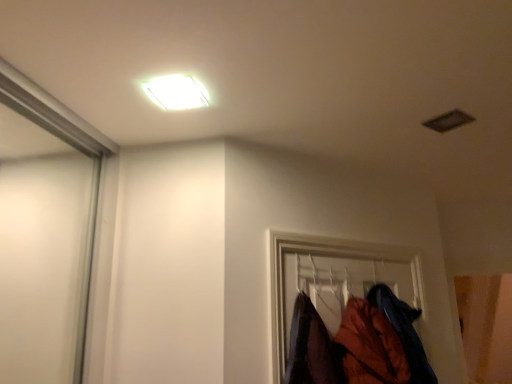
Question: Does velvet-like orange coat at lower right, which is the second clothing in right-to-left order, come behind white glossy light fixture at upper center?

Choices:
 (A) no
 (B) yes

Answer: (B)

Question: Is velvet-like orange coat at lower right, which is the first clothing from left to right, oriented towards white glossy light fixture at upper center?

Choices:
 (A) yes
 (B) no

Answer: (B)

Question: From a real-world perspective, is velvet-like orange coat at lower right, which is the first clothing from left to right, on white glossy light fixture at upper center?

Choices:
 (A) yes
 (B) no

Answer: (B)

Question: Is the surface of velvet-like orange coat at lower right, which is the first clothing from left to right, in direct contact with white glossy light fixture at upper center?

Choices:
 (A) no
 (B) yes

Answer: (A)

Question: Can white glossy light fixture at upper center be found inside velvet-like orange coat at lower right, which is the second clothing in right-to-left order?

Choices:
 (A) no
 (B) yes

Answer: (A)

Question: Is point (202, 96) closer or farther from the camera than point (421, 369)?

Choices:
 (A) closer
 (B) farther

Answer: (A)

Question: Considering the positions of white glossy light fixture at upper center and orange fabric coat at lower right, which is counted as the 2th clothing, starting from the left, in the image, is white glossy light fixture at upper center wider or thinner than orange fabric coat at lower right, which is counted as the 2th clothing, starting from the left,?

Choices:
 (A) wide
 (B) thin

Answer: (B)

Question: Visually, is white glossy light fixture at upper center positioned to the left or to the right of orange fabric coat at lower right, which is counted as the 2th clothing, starting from the left?

Choices:
 (A) left
 (B) right

Answer: (A)

Question: From the image's perspective, relative to orange fabric coat at lower right, placed as the 1th clothing when sorted from right to left, is white glossy light fixture at upper center above or below?

Choices:
 (A) below
 (B) above

Answer: (B)

Question: In terms of height, does velvet-like orange coat at lower right, which is the second clothing in right-to-left order, look taller or shorter compared to orange fabric coat at lower right, which is counted as the 2th clothing, starting from the left?

Choices:
 (A) short
 (B) tall

Answer: (A)

Question: Is velvet-like orange coat at lower right, which is the second clothing in right-to-left order, spatially inside orange fabric coat at lower right, placed as the 1th clothing when sorted from right to left, or outside of it?

Choices:
 (A) outside
 (B) inside

Answer: (A)

Question: Visually, is velvet-like orange coat at lower right, which is the first clothing from left to right, positioned to the left or to the right of orange fabric coat at lower right, which is counted as the 2th clothing, starting from the left?

Choices:
 (A) right
 (B) left

Answer: (B)

Question: Looking at their shapes, would you say velvet-like orange coat at lower right, which is the first clothing from left to right, is wider or thinner than orange fabric coat at lower right, placed as the 1th clothing when sorted from right to left?

Choices:
 (A) wide
 (B) thin

Answer: (A)

Question: Do you think velvet-like orange coat at lower right, which is the first clothing from left to right, is within white glossy light fixture at upper center, or outside of it?

Choices:
 (A) outside
 (B) inside

Answer: (A)

Question: From the image's perspective, is velvet-like orange coat at lower right, which is the second clothing in right-to-left order, positioned above or below white glossy light fixture at upper center?

Choices:
 (A) above
 (B) below

Answer: (B)